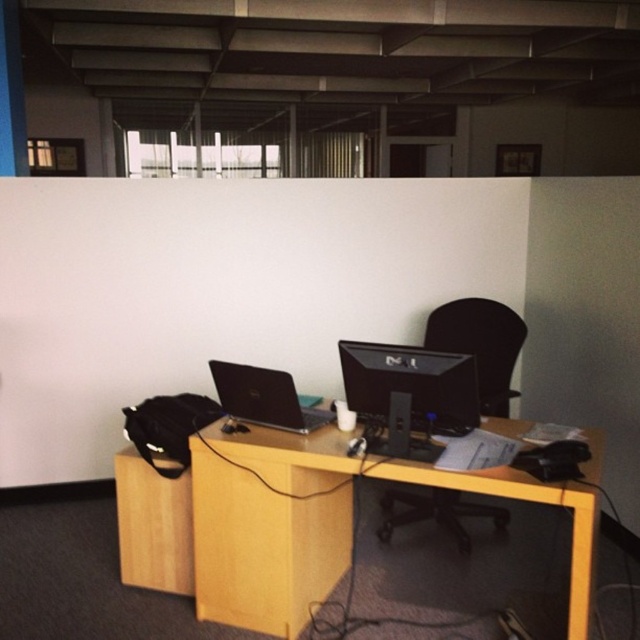
Can you confirm if black glossy monitor at center is taller than matte black laptop at center?

Correct, black glossy monitor at center is much taller as matte black laptop at center.

Is black glossy monitor at center below matte black laptop at center?

Actually, black glossy monitor at center is above matte black laptop at center.

Is point (388, 451) farther from camera compared to point (227, 371)?

No, (388, 451) is in front of (227, 371).

Locate an element on the screen. The image size is (640, 640). black glossy monitor at center is located at coordinates (408, 394).

Does light wood/wooden computer desk at center have a lesser height compared to black glossy monitor at center?

No, light wood/wooden computer desk at center is not shorter than black glossy monitor at center.

Does light wood/wooden computer desk at center appear on the left side of black glossy monitor at center?

Yes, light wood/wooden computer desk at center is to the left of black glossy monitor at center.

Between point (298, 481) and point (378, 388), which one is positioned behind?

Point (298, 481)

Find the location of a particular element. light wood/wooden computer desk at center is located at coordinates (330, 520).

Is light wood/wooden computer desk at center closer to camera compared to matte black laptop at center?

That is True.

From the picture: Who is higher up, light wood/wooden computer desk at center or matte black laptop at center?

Positioned higher is matte black laptop at center.

Which is in front, point (333, 440) or point (259, 388)?

Positioned in front is point (333, 440).

You are a GUI agent. You are given a task and a screenshot of the screen. Output one action in this format:
    pyautogui.click(x=<x>, y=<y>)
    Task: Click on the light wood/wooden computer desk at center
    
    Given the screenshot: What is the action you would take?
    pyautogui.click(x=330, y=520)